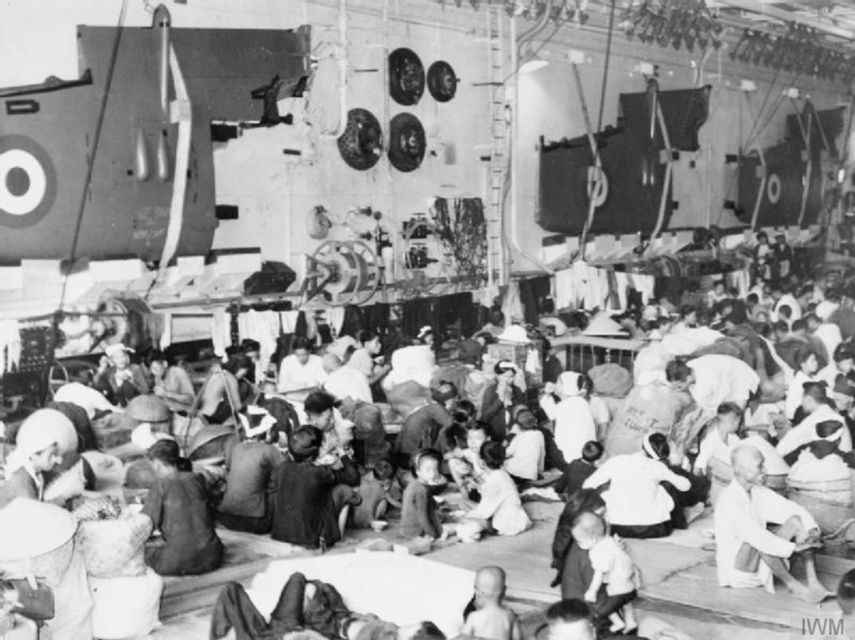
Question: Which of the following is the farthest from the observer?

Choices:
 (A) (473, 637)
 (B) (765, 566)
 (C) (611, 595)

Answer: (B)

Question: Estimate the real-world distances between objects in this image. Which object is closer to the smooth skin baby at center?

Choices:
 (A) matte black clothing at center
 (B) white cloth at center

Answer: (A)

Question: Does matte black clothing at center appear on the left side of white cloth baby at center?

Choices:
 (A) yes
 (B) no

Answer: (A)

Question: Which object is closer to the camera taking this photo?

Choices:
 (A) white cloth at center
 (B) white cloth baby at center
 (C) matte black clothing at center
 (D) smooth skin baby at center

Answer: (D)

Question: Does matte black clothing at center have a greater width compared to white cloth at center?

Choices:
 (A) yes
 (B) no

Answer: (A)

Question: Does matte black clothing at center come behind smooth skin baby at center?

Choices:
 (A) no
 (B) yes

Answer: (B)